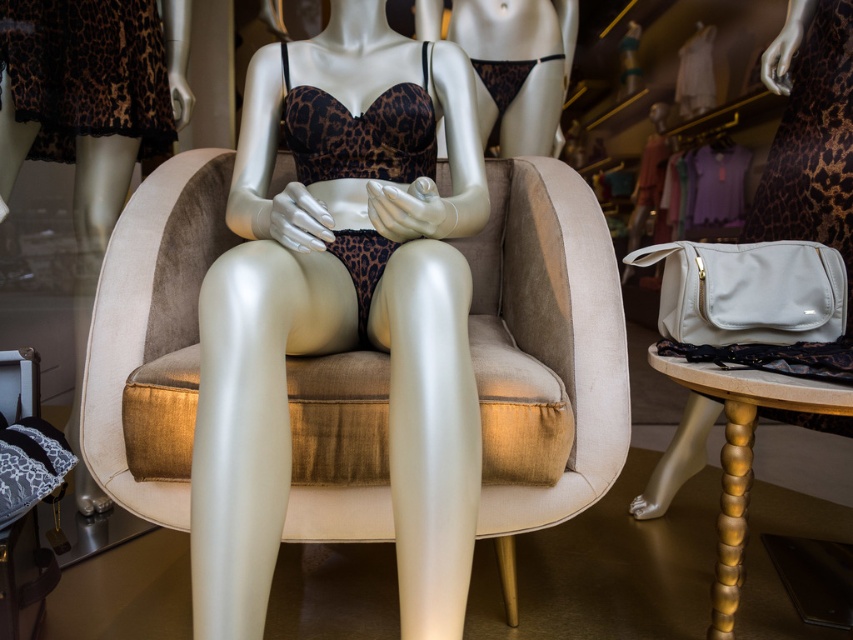
You are a store employee and you need to place a new tag at point [402,243] on the mannequin. The tag is 2 inches thick. Will the tag be visible from the front of the mannequin?

The distance of point [402,243] from camera is 38.76 inches. Since the tag is only 2 inches thick, it will be visible from the front of the mannequin as it won not block the view significantly.

You are a customer in the store and want to see the leopard print fabric bra and panties at center. Since you are of average height, will you need to stand on the beige velvet armchair at center to reach them?

The leopard print fabric bra and panties at center is shorter than the beige velvet armchair at center, so you won not need to stand on the chair to see them since they are placed lower than the chair.

You are a store employee who needs to place a new price tag on the leopard print fabric bra and panties at center. The store requires that all price tags must be placed at coordinates point (x=338, y=349). Can you confirm if this point is on the correct item?

Yes, the point (x=338, y=349) is on the leopard print fabric bra and panties at center, so placing the price tag there will be correct.